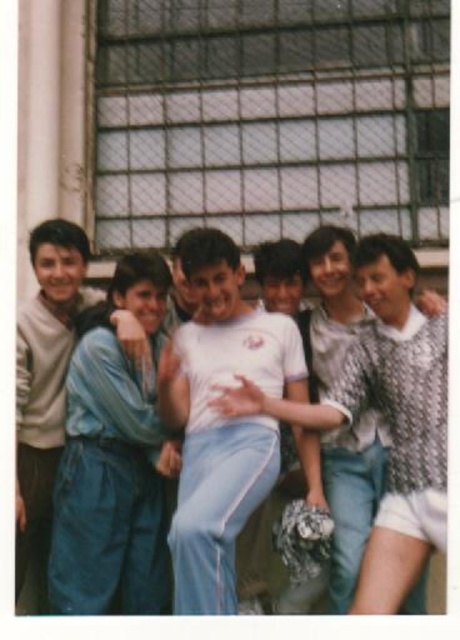
Question: Which point is closer to the camera?

Choices:
 (A) blue fabric at center
 (B) sweater at left
 (C) white matte t-shirt at center

Answer: (C)

Question: Which of the following is the closest to the observer?

Choices:
 (A) white matte t-shirt at center
 (B) white cotton shirt at center
 (C) sweater at left

Answer: (A)

Question: Which point appears farthest from the camera in this image?

Choices:
 (A) (189, 260)
 (B) (436, 342)
 (C) (17, 477)

Answer: (A)

Question: From the image, what is the correct spatial relationship of white matte t-shirt at center in relation to blue fabric at center?

Choices:
 (A) above
 (B) below

Answer: (A)

Question: Does blue fabric at center appear on the left side of white cotton shirt at center?

Choices:
 (A) no
 (B) yes

Answer: (B)

Question: Can you confirm if white cotton shirt at center is wider than sweater at left?

Choices:
 (A) no
 (B) yes

Answer: (B)